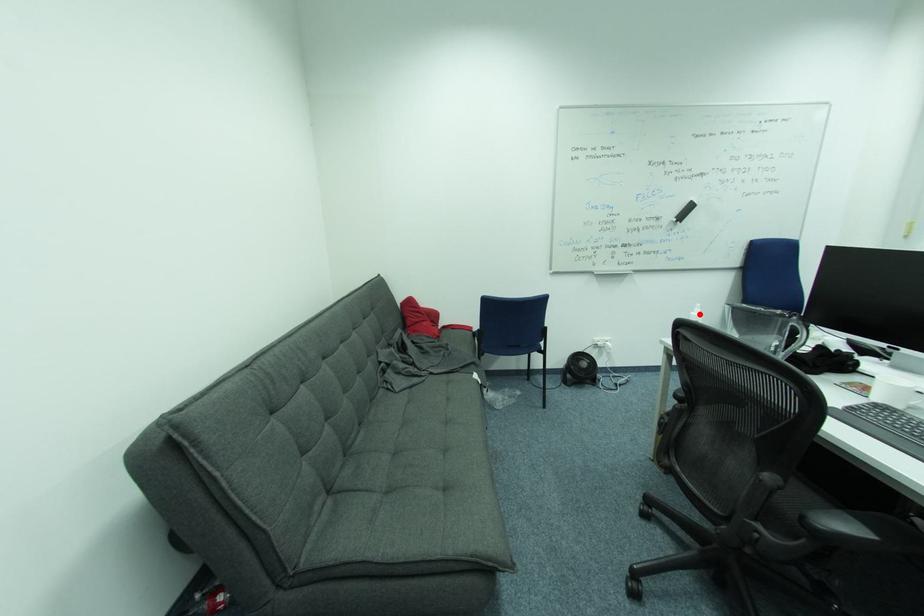
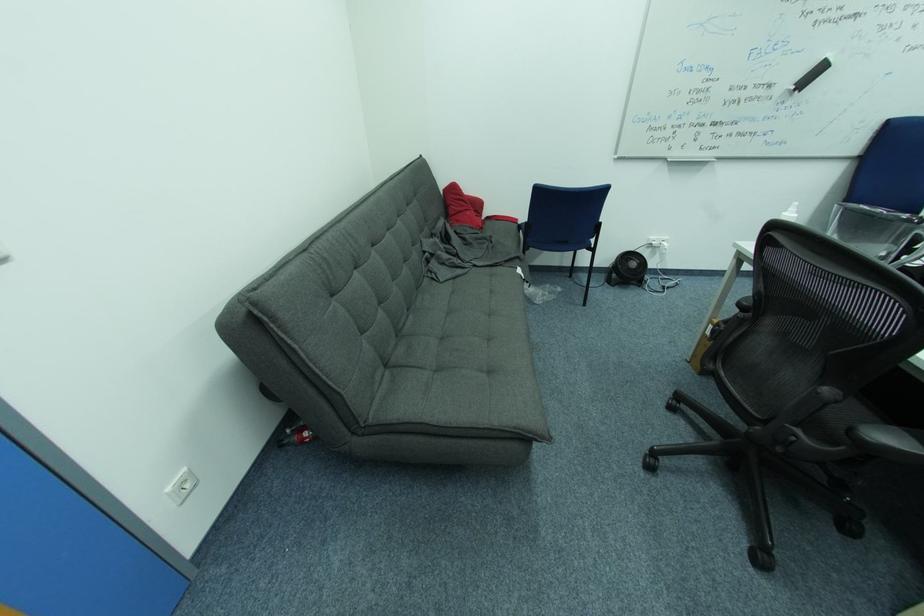
Find the pixel in the second image that matches the highlighted location in the first image.

(792, 215)